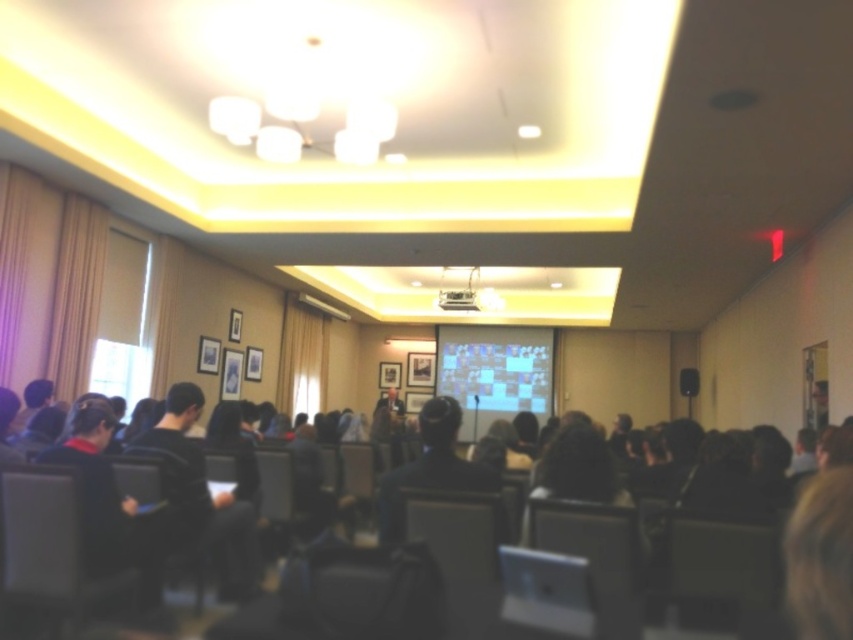
Question: Where is matte white projection screen at center located in relation to white plastic projector at upper center in the image?

Choices:
 (A) below
 (B) above

Answer: (A)

Question: Does matte white projection screen at center have a larger size compared to black matte speaker at center?

Choices:
 (A) no
 (B) yes

Answer: (B)

Question: Can you confirm if white plastic projector at upper center is positioned above black matte speaker at center?

Choices:
 (A) yes
 (B) no

Answer: (A)

Question: Which object is the closest to the matte white projection screen at center?

Choices:
 (A) matte gray chair at lower left
 (B) white plastic projector at upper center
 (C) black matte speaker at center

Answer: (B)

Question: Which of the following is the closest to the observer?

Choices:
 (A) (498, 328)
 (B) (473, 301)

Answer: (B)

Question: Among these objects, which one is nearest to the camera?

Choices:
 (A) black matte speaker at center
 (B) matte gray chair at lower left

Answer: (B)